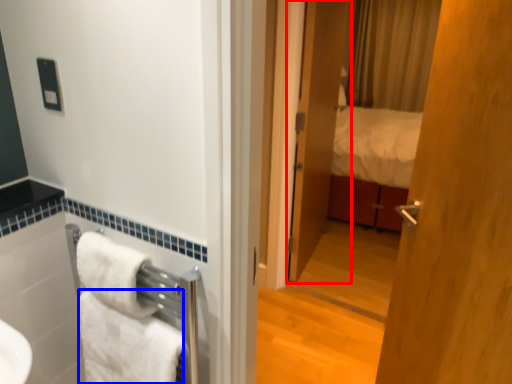
Question: Which object is further to the camera taking this photo, door (highlighted by a red box) or towel/napkin (highlighted by a blue box)?

Choices:
 (A) door
 (B) towel/napkin

Answer: (A)